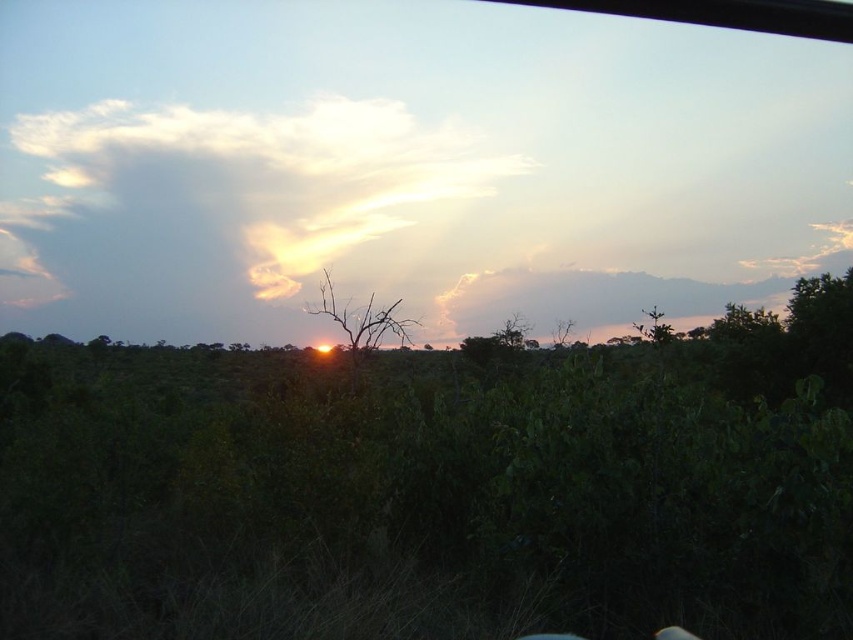
You are standing in the middle of the dense green landscape depicted in the image. You notice a specific point marked at coordinates point (363, 320). What object is located exactly at that point?

The brown dry at center is located at point (363, 320).

You are an astronomer observing the sunset and want to mark the position of the sun. You have a coordinate grid overlay on your screen. The coordinates are given as fractions between 0 and 1, where 0 is the bottom left corner of the image. You see a point at coordinate point (231, 196). Is this point on the sun or on the cloudy sky at upper center?

The point (231, 196) is on cloudy sky at upper center, so it is not on the sun.